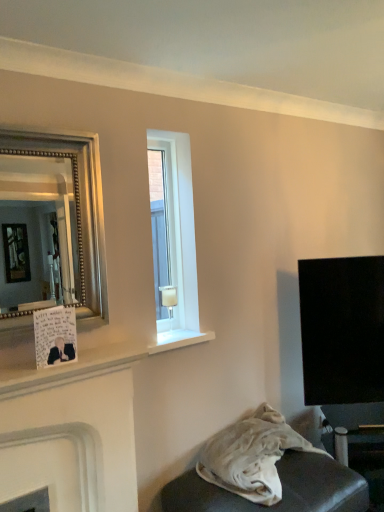
Question: Is the position of white matte fireplace at lower left more distant than that of clear glass window at center?

Choices:
 (A) yes
 (B) no

Answer: (B)

Question: Is white matte fireplace at lower left positioned before clear glass window at center?

Choices:
 (A) yes
 (B) no

Answer: (A)

Question: Does white matte fireplace at lower left have a greater width compared to clear glass window at center?

Choices:
 (A) yes
 (B) no

Answer: (A)

Question: Considering the relative sizes of white matte fireplace at lower left and clear glass window at center in the image provided, is white matte fireplace at lower left taller than clear glass window at center?

Choices:
 (A) no
 (B) yes

Answer: (A)

Question: Would you say white matte fireplace at lower left is outside clear glass window at center?

Choices:
 (A) no
 (B) yes

Answer: (B)

Question: Could you tell me if white matte fireplace at lower left is turned towards clear glass window at center?

Choices:
 (A) yes
 (B) no

Answer: (B)

Question: Does white matte fireplace at lower left appear on the left side of silver beaded mirror at left?

Choices:
 (A) yes
 (B) no

Answer: (B)

Question: Would you say white matte fireplace at lower left contains silver beaded mirror at left?

Choices:
 (A) no
 (B) yes

Answer: (A)

Question: Could you tell me if white matte fireplace at lower left is facing silver beaded mirror at left?

Choices:
 (A) no
 (B) yes

Answer: (A)

Question: Does white matte fireplace at lower left have a greater width compared to silver beaded mirror at left?

Choices:
 (A) no
 (B) yes

Answer: (B)

Question: From a real-world perspective, is white matte fireplace at lower left located higher than silver beaded mirror at left?

Choices:
 (A) no
 (B) yes

Answer: (A)

Question: Does white matte fireplace at lower left have a greater height compared to silver beaded mirror at left?

Choices:
 (A) no
 (B) yes

Answer: (B)

Question: Is silver beaded mirror at left further to camera compared to white fabric at lower right?

Choices:
 (A) yes
 (B) no

Answer: (B)